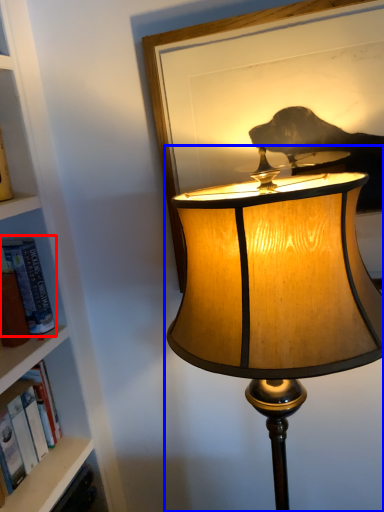
Question: Which of the following is the farthest to the observer, book (highlighted by a red box) or lamp (highlighted by a blue box)?

Choices:
 (A) book
 (B) lamp

Answer: (A)